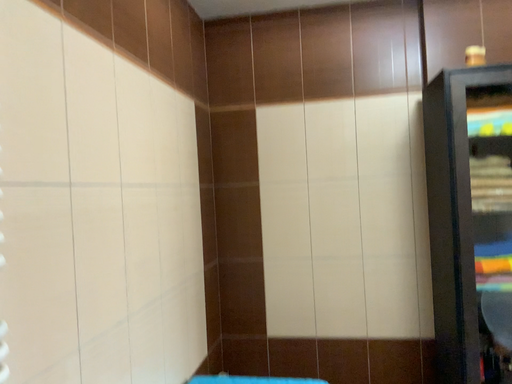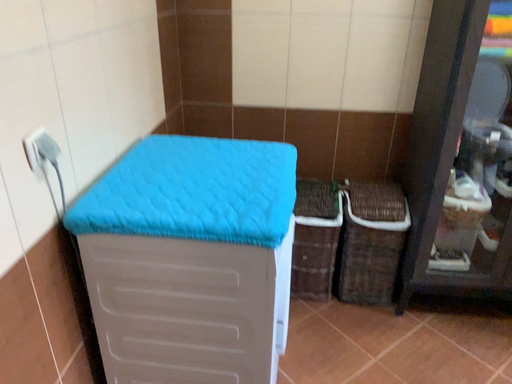
Question: Which way did the camera rotate in the video?

Choices:
 (A) rotated downward
 (B) rotated upward

Answer: (A)